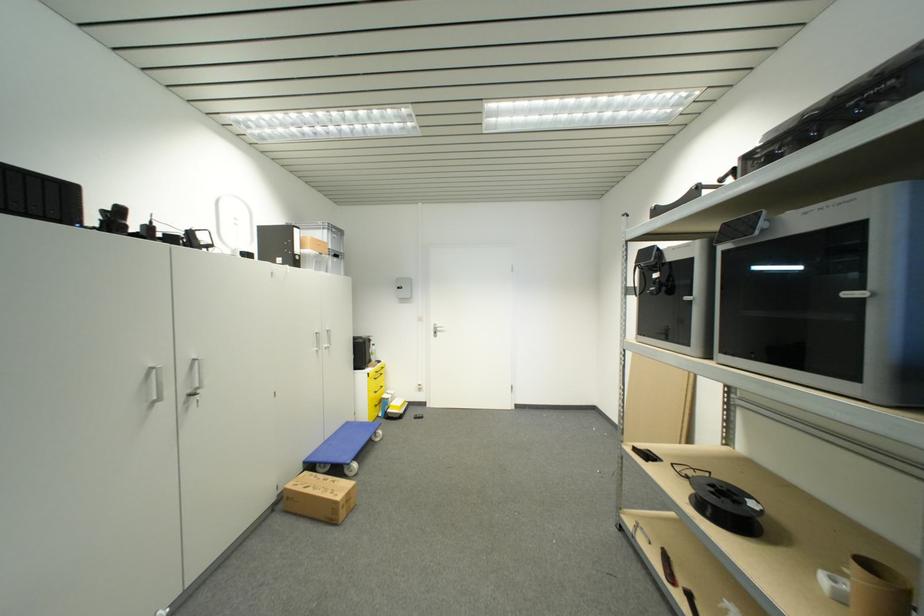
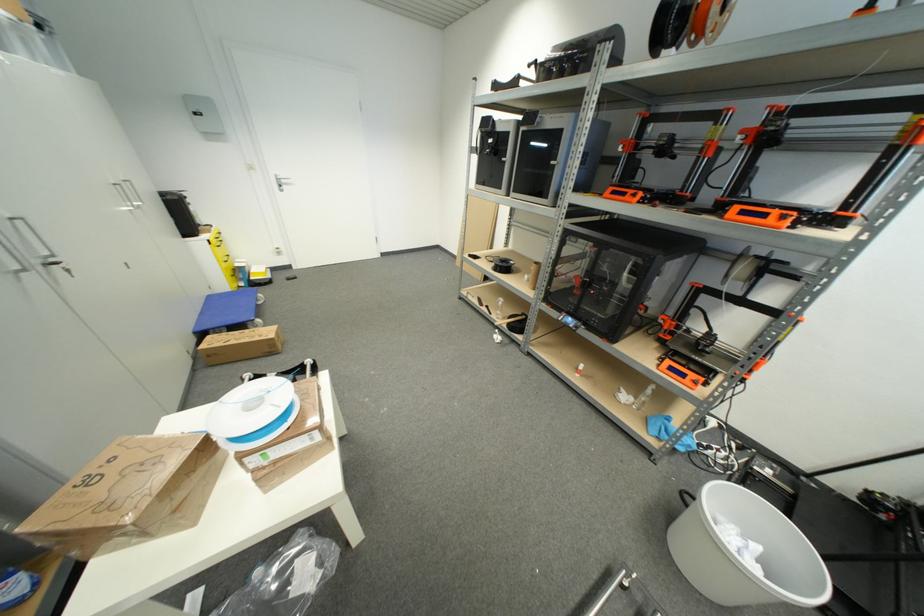
First-person continuous shooting, in which direction is the camera rotating?

The camera's rotation is toward right-down.